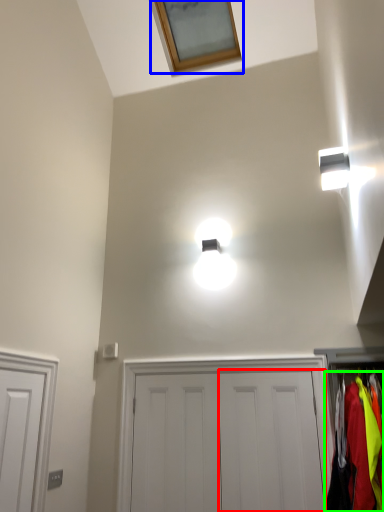
Question: Which object is the closest to the door (highlighted by a red box)? Choose among these: window (highlighted by a blue box) or clothing (highlighted by a green box).

Choices:
 (A) window
 (B) clothing

Answer: (B)